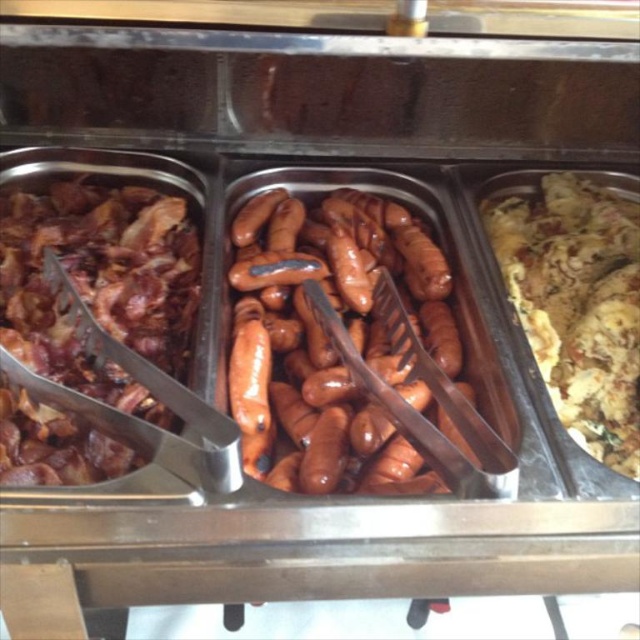
You are a food critic evaluating the buffet layout. The shiny brown bacon at left and yellow crumbly at right are two of the dishes. Which dish is positioned closer to the front of the buffet station?

The shiny brown bacon at left is shorter than the yellow crumbly at right, so the shiny brown bacon at left is closer to the front of the buffet station because shorter objects appear closer in such setups.

You are at a buffet and want to grab both the glossy brown sausages at center and the shiny brown bacon at left. Which one should you reach for first if you want to pick up the one closer to you?

The glossy brown sausages at center is located below the shiny brown bacon at left, which means it is closer to you. Therefore, you should reach for the glossy brown sausages at center first.

You are at a buffet and want to choose between the glossy brown sausages at center and the shiny brown bacon at left. Which one is thinner?

The glossy brown sausages at center are thinner than the shiny brown bacon at left.